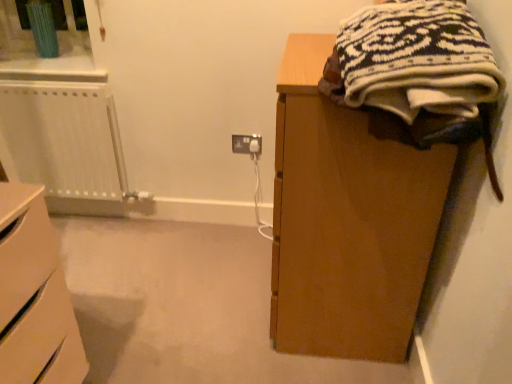
Where is `free spot above white plastic radiator at left (from a real-world perspective)`? free spot above white plastic radiator at left (from a real-world perspective) is located at coordinates (47, 73).